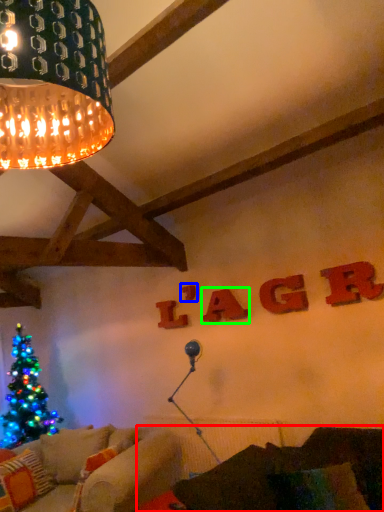
Question: Estimate the real-world distances between objects in this image. Which object is closer to couch (highlighted by a red box), letter (highlighted by a blue box) or letter (highlighted by a green box)?

Choices:
 (A) letter
 (B) letter

Answer: (B)